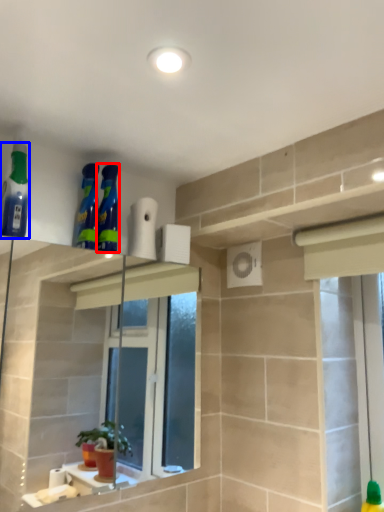
Question: Which of the following is the farthest to the observer, cleaning product (highlighted by a red box) or cleaning product (highlighted by a blue box)?

Choices:
 (A) cleaning product
 (B) cleaning product

Answer: (A)